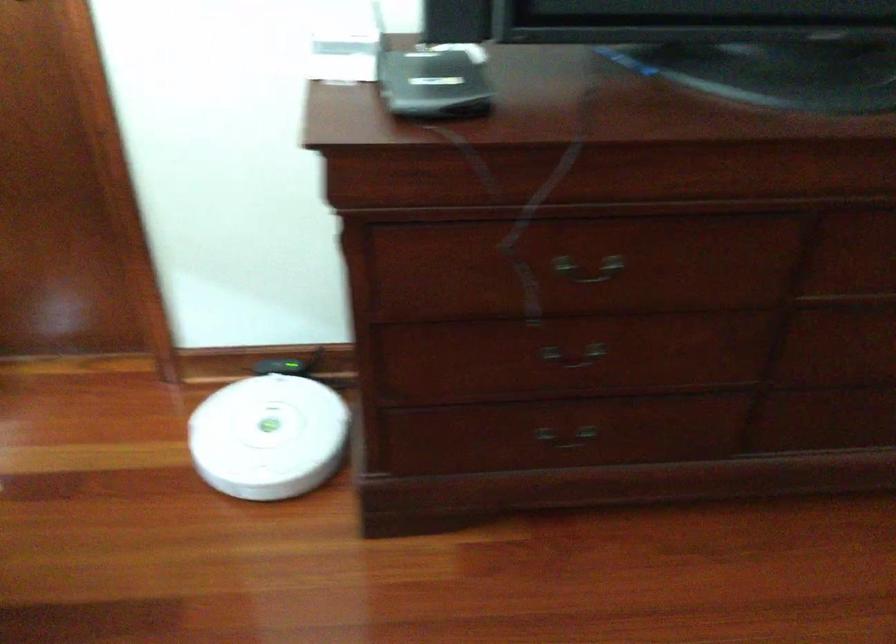
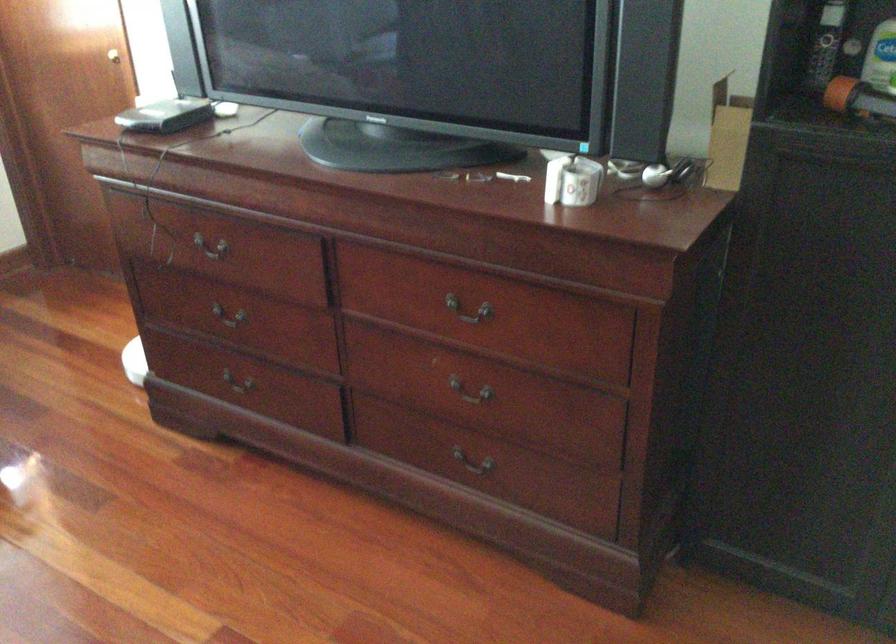
The point at [530,332] is marked in the first image. Where is the corresponding point in the second image?

(229, 313)